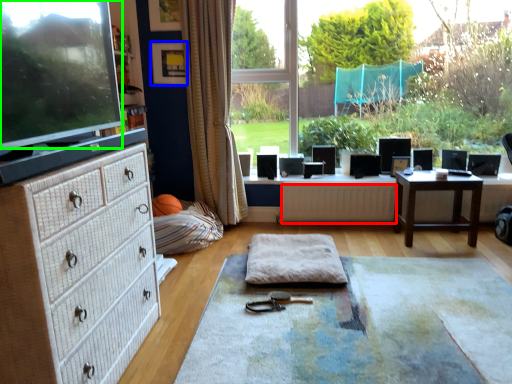
Question: Estimate the real-world distances between objects in this image. Which object is closer to radiator (highlighted by a red box), picture frame (highlighted by a blue box) or computer monitor (highlighted by a green box)?

Choices:
 (A) picture frame
 (B) computer monitor

Answer: (A)